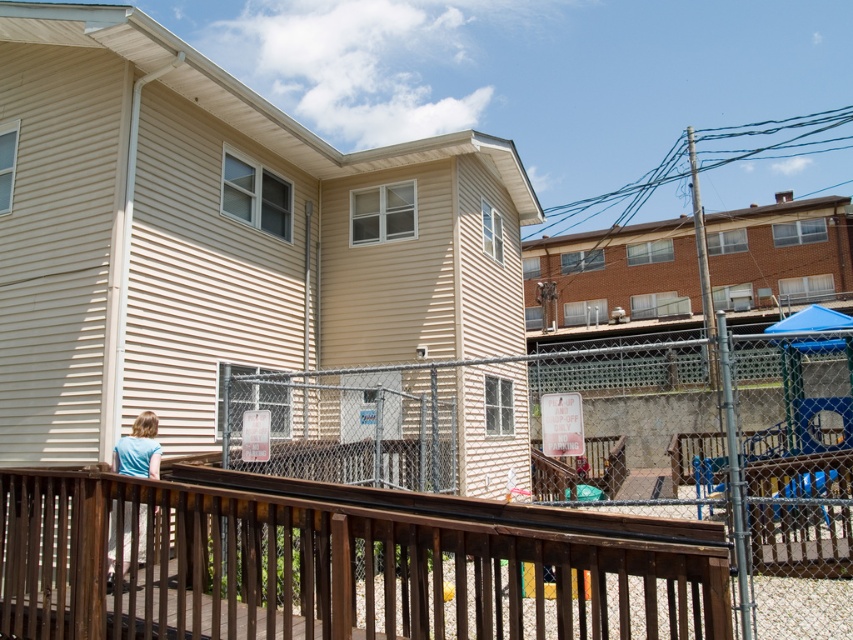
Looking at this image, you are standing on a deck and want to walk towards the brown wooden fence at lower center. According to the coordinates provided, in which direction should you move relative to your current position?

You should move towards the coordinates point at (448,524) to reach the brown wooden fence at lower center.

You are standing at the center of the image and want to walk towards the brown wooden railing at lower center. According to the coordinates provided, in which direction should you move?

The brown wooden railing at lower center is located at coordinates point (323, 568). Since the y coordinate 0.380 is closer to the bottom of the image, you should move downward to reach it.

You are standing on a deck looking at the scene. There is a brown wooden railing at lower center and a light blue shirt at lower left. Which object is higher from the ground?

The brown wooden railing at lower center is higher from the ground than the light blue shirt at lower left because it is located above it.